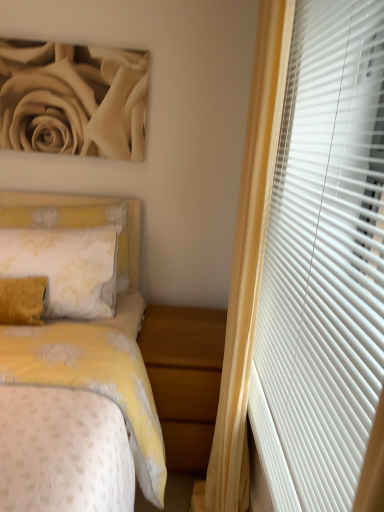
Question: Considering the positions of yellow fabric headboard at left and white matte blinds at right in the image, is yellow fabric headboard at left wider or thinner than white matte blinds at right?

Choices:
 (A) thin
 (B) wide

Answer: (B)

Question: In terms of height, does yellow fabric headboard at left look taller or shorter compared to white matte blinds at right?

Choices:
 (A) tall
 (B) short

Answer: (B)

Question: Estimate the real-world distances between objects in this image. Which object is closer to the yellow fabric headboard at left?

Choices:
 (A) white matte blinds at right
 (B) wooden nightstand at lower center

Answer: (B)

Question: Estimate the real-world distances between objects in this image. Which object is farther from the yellow fabric headboard at left?

Choices:
 (A) white matte blinds at right
 (B) wooden nightstand at lower center

Answer: (A)